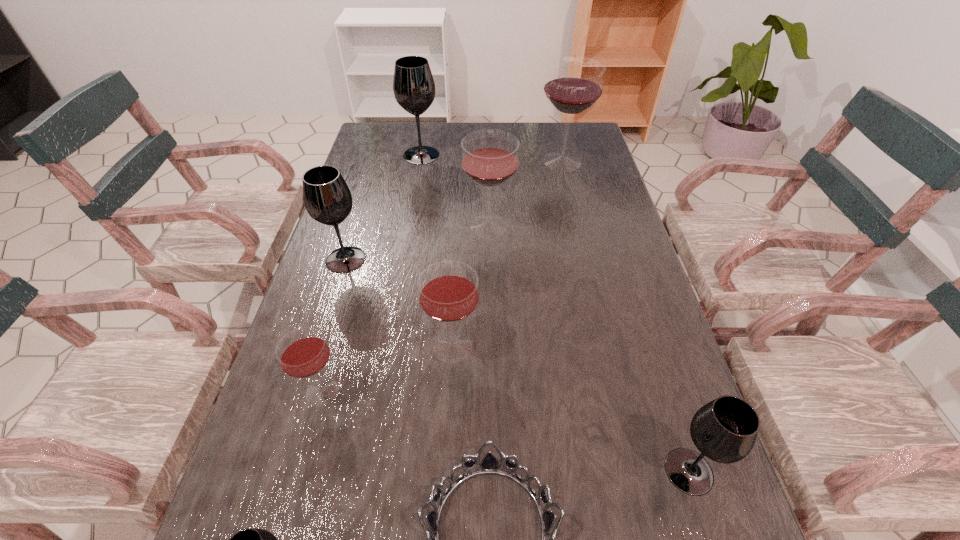
Locate an element on the screen. the biggest red wineglass is located at coordinates (574, 84).

At what (x,y) coordinates should I click in order to perform the action: click on the rightmost red wineglass. Please return your answer as a coordinate pair (x, y). Looking at the image, I should click on (574, 84).

Identify the location of the sixth object from right to left. This screenshot has height=540, width=960. (414, 88).

You are a GUI agent. You are given a task and a screenshot of the screen. Output one action in this format:
    pyautogui.click(x=<x>, y=<y>)
    Task: Click on the second gray wineglass from right to left
    The width and height of the screenshot is (960, 540).
    Given the screenshot: What is the action you would take?
    pyautogui.click(x=414, y=88)

Find the location of a particular element. Image resolution: width=960 pixels, height=540 pixels. the fifth nearest wineglass is located at coordinates (327, 198).

Image resolution: width=960 pixels, height=540 pixels. I want to click on the third nearest gray wineglass, so click(327, 198).

Identify the location of the third nearest red wineglass. (489, 158).

At what (x,y) coordinates should I click in order to perform the action: click on the third farthest wineglass. Please return your answer as a coordinate pair (x, y). The image size is (960, 540). Looking at the image, I should click on (489, 158).

The image size is (960, 540). I want to click on the third biggest red wineglass, so click(448, 290).

This screenshot has width=960, height=540. Find the location of `the third farthest red wineglass`. the third farthest red wineglass is located at coordinates (448, 290).